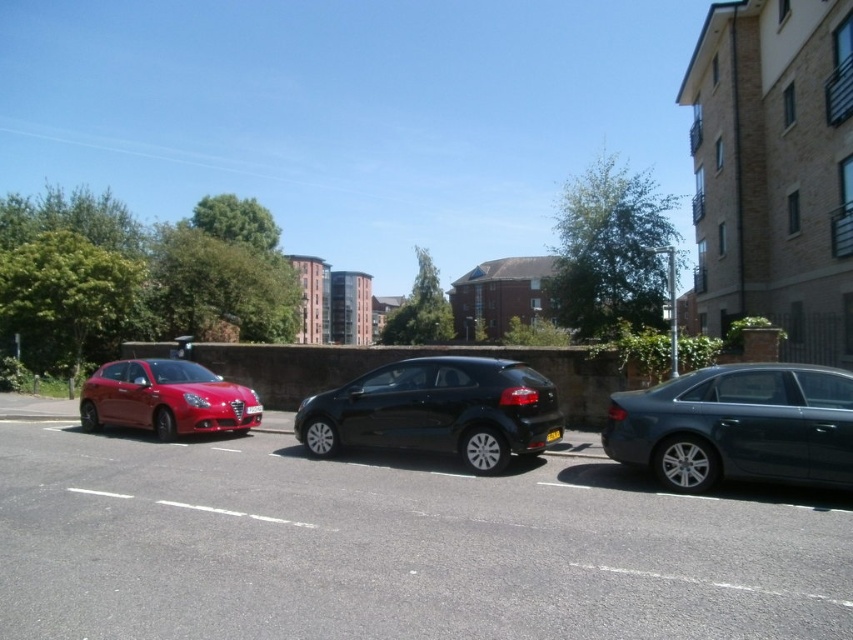
You are a delivery driver who needs to park your vehicle between the satin dark gray sedan at right and the matte red hatchback at left. Based on their sizes, which vehicle should you park closer to in order to fit your truck?

Since the satin dark gray sedan at right occupies less space than the matte red hatchback at left, you should park closer to the satin dark gray sedan at right to accommodate your truck.

You are standing on the sidewalk and want to cross the street to reach the modern glass building. The crosswalk is 10 meters away. Can you safely cross before the glossy black hatchback at center, which is 8.90 meters away from you, reaches the crosswalk?

The glossy black hatchback at center is 8.90 meters away from you. Since the crosswalk is 10 meters away, the distance between the car and the crosswalk is 1.1 meters. However, this calculation doesn not account for the car speed or your walking speed. Without knowing the car speed, it is impossible to determine if you can safely cross before the car arrives.